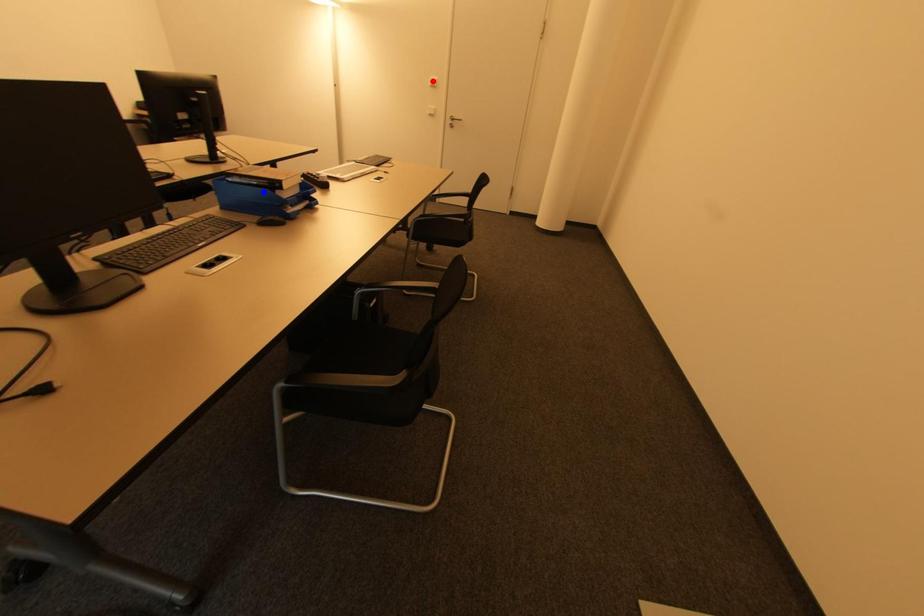
Question: Two points are marked on the image. Which point is closer to the camera?

Choices:
 (A) Blue point is closer.
 (B) Red point is closer.

Answer: (A)